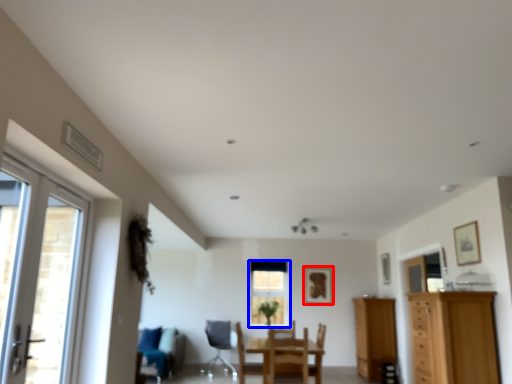
Question: Which point is closer to the camera, picture frame (highlighted by a red box) or window (highlighted by a blue box)?

Choices:
 (A) picture frame
 (B) window

Answer: (A)